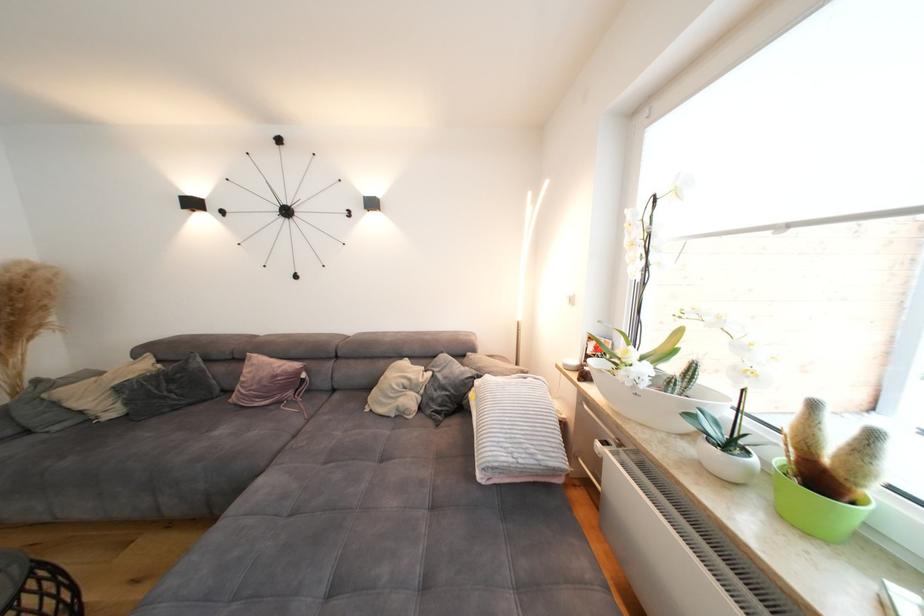
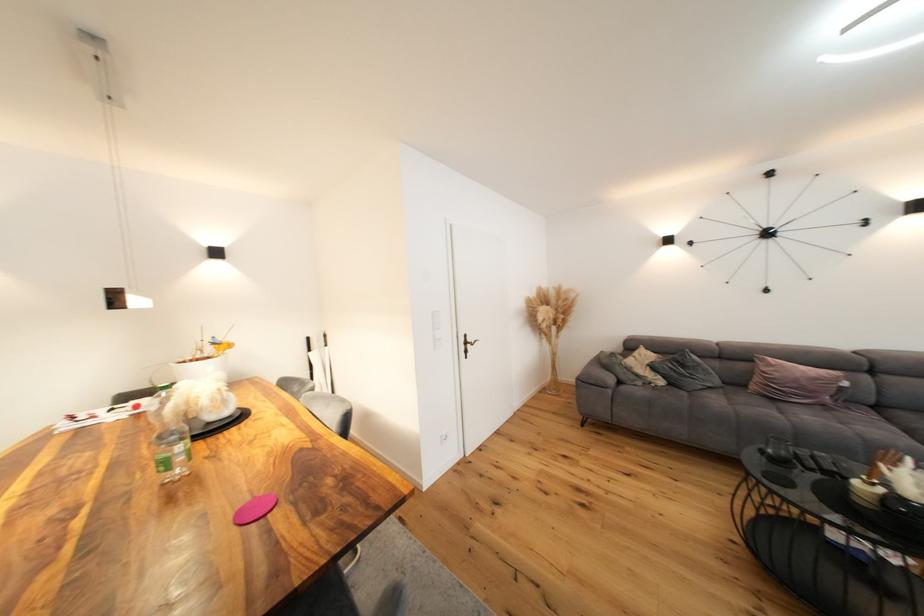
The point at (283,378) is marked in the first image. Where is the corresponding point in the second image?

(822, 381)